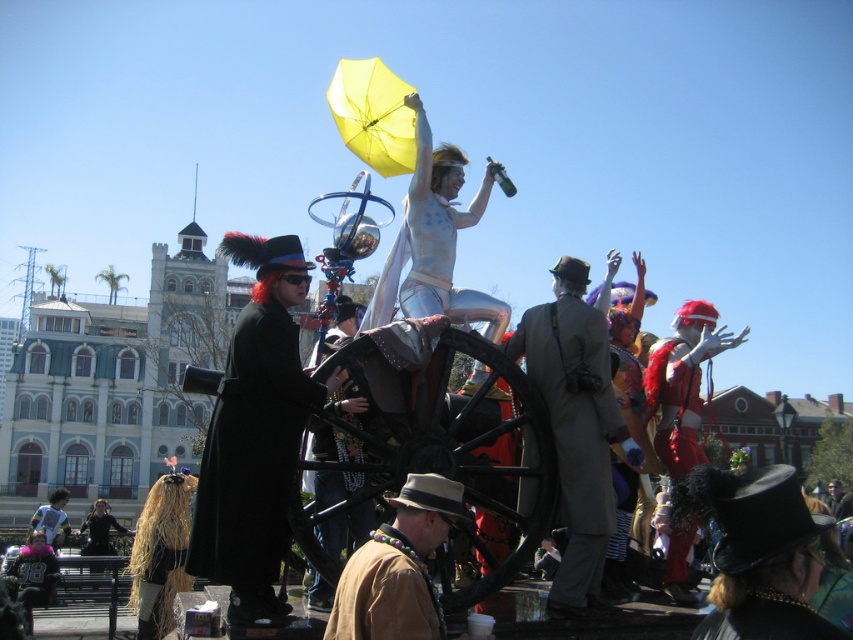
Question: Based on their relative distances, which object is farther from the velvet red coat at center?

Choices:
 (A) silver metallic suit at upper center
 (B) black matte coat at left
 (C) gray wool coat at center

Answer: (B)

Question: Among these points, which one is farthest from the camera?

Choices:
 (A) (456, 321)
 (B) (410, 572)
 (C) (234, 378)

Answer: (A)

Question: Does black matte coat at left appear on the left side of velvet red coat at center?

Choices:
 (A) no
 (B) yes

Answer: (B)

Question: Which of these objects is positioned closest to the brown leather jacket at lower center?

Choices:
 (A) gray wool coat at center
 (B) black matte coat at left

Answer: (B)

Question: Does black matte coat at left appear on the left side of silver metallic suit at upper center?

Choices:
 (A) no
 (B) yes

Answer: (B)

Question: From the image, what is the correct spatial relationship of brown leather jacket at lower center in relation to velvet red coat at center?

Choices:
 (A) above
 (B) below

Answer: (B)